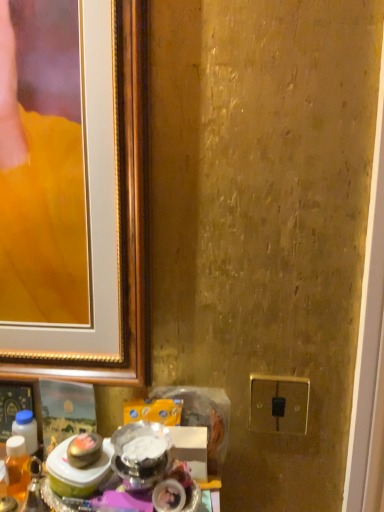
Question: Can you confirm if gold metallic switch at lower right is thinner than translucent amber liquid at lower left?

Choices:
 (A) no
 (B) yes

Answer: (B)

Question: Considering the relative positions of gold metallic switch at lower right and translucent amber liquid at lower left in the image provided, is gold metallic switch at lower right to the left of translucent amber liquid at lower left from the viewer's perspective?

Choices:
 (A) yes
 (B) no

Answer: (B)

Question: Is gold metallic switch at lower right placed right next to translucent amber liquid at lower left?

Choices:
 (A) no
 (B) yes

Answer: (A)

Question: Does gold metallic switch at lower right have a greater width compared to translucent amber liquid at lower left?

Choices:
 (A) no
 (B) yes

Answer: (A)

Question: Is gold metallic switch at lower right bigger than translucent amber liquid at lower left?

Choices:
 (A) no
 (B) yes

Answer: (A)

Question: From the image's perspective, is gold metallic switch at lower right over translucent amber liquid at lower left?

Choices:
 (A) yes
 (B) no

Answer: (A)

Question: From the image's perspective, is translucent amber liquid at lower left on top of gold metallic switch at lower right?

Choices:
 (A) yes
 (B) no

Answer: (B)

Question: Considering the relative sizes of translucent amber liquid at lower left and gold metallic switch at lower right in the image provided, is translucent amber liquid at lower left thinner than gold metallic switch at lower right?

Choices:
 (A) yes
 (B) no

Answer: (B)

Question: Is translucent amber liquid at lower left facing towards gold metallic switch at lower right?

Choices:
 (A) yes
 (B) no

Answer: (B)

Question: Does translucent amber liquid at lower left lie in front of gold metallic switch at lower right?

Choices:
 (A) yes
 (B) no

Answer: (A)

Question: Does translucent amber liquid at lower left have a greater height compared to gold metallic switch at lower right?

Choices:
 (A) yes
 (B) no

Answer: (A)

Question: Is translucent amber liquid at lower left at the right side of gold metallic switch at lower right?

Choices:
 (A) no
 (B) yes

Answer: (A)

Question: In terms of height, does gold metallic switch at lower right look taller or shorter compared to translucent amber liquid at lower left?

Choices:
 (A) short
 (B) tall

Answer: (A)